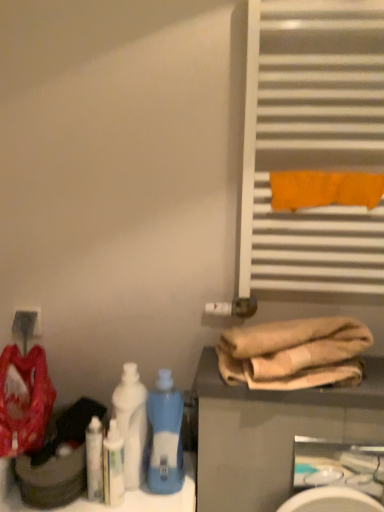
The image size is (384, 512). What do you see at coordinates (24, 400) in the screenshot? I see `matte red fabric at left` at bounding box center [24, 400].

Where is `white metallic radiator at upper right`? This screenshot has width=384, height=512. white metallic radiator at upper right is located at coordinates (312, 143).

What do you see at coordinates (292, 353) in the screenshot?
I see `beige cotton towels at lower right` at bounding box center [292, 353].

Locate an element on the screen. The height and width of the screenshot is (512, 384). matte white electric outlet at lower left is located at coordinates (27, 323).

Does white glossy bottle at lower left, marked as the 2th cleaning product in a left-to-right arrangement, have a smaller size compared to white glossy sink at lower right?

Correct, white glossy bottle at lower left, marked as the 2th cleaning product in a left-to-right arrangement, occupies less space than white glossy sink at lower right.

Looking at this image, how much distance is there between white glossy bottle at lower left, which is the 1th cleaning product in right-to-left order, and white glossy sink at lower right?

The distance of white glossy bottle at lower left, which is the 1th cleaning product in right-to-left order, from white glossy sink at lower right is 5.19 feet.

Is white glossy bottle at lower left, which is the 1th cleaning product in right-to-left order, at the right side of white glossy sink at lower right?

In fact, white glossy bottle at lower left, which is the 1th cleaning product in right-to-left order, is to the left of white glossy sink at lower right.

In terms of width, does white glossy bottle at lower left, which is the 1th cleaning product in right-to-left order, look wider or thinner when compared to white glossy sink at lower right?

In the image, white glossy bottle at lower left, which is the 1th cleaning product in right-to-left order, appears to be wider than white glossy sink at lower right.

Is white metallic radiator at upper right not close to beige cotton towels at lower right?

Actually, white metallic radiator at upper right and beige cotton towels at lower right are a little close together.

Which is more to the left, white metallic radiator at upper right or beige cotton towels at lower right?

From the viewer's perspective, beige cotton towels at lower right appears more on the left side.

Is white metallic radiator at upper right situated inside beige cotton towels at lower right or outside?

white metallic radiator at upper right lies outside beige cotton towels at lower right.

Is point (312, 112) more distant than point (245, 349)?

That is True.

From a real-world perspective, between matte red fabric at left and white plastic bottle at center, the 2th bottle positioned from the right, who is vertically lower?

In real-world perspective, white plastic bottle at center, the 2th bottle positioned from the right, is lower.

From the image's perspective, would you say matte red fabric at left is positioned over white plastic bottle at center, the first bottle positioned from the left?

Yes.

Where is `material that appears in front of the white plastic bottle at center, the first bottle positioned from the left`? material that appears in front of the white plastic bottle at center, the first bottle positioned from the left is located at coordinates (24, 400).

Does matte red fabric at left contain white plastic bottle at center, the 2th bottle positioned from the right?

No, white plastic bottle at center, the 2th bottle positioned from the right, is located outside of matte red fabric at left.

Between white glossy bottle at lower left, marked as the 2th cleaning product in a left-to-right arrangement, and white plastic bottle at center, the first bottle positioned from the left, which one has less height?

With less height is white glossy bottle at lower left, marked as the 2th cleaning product in a left-to-right arrangement.

Does point (120, 443) appear closer or farther from the camera than point (143, 435)?

Point (120, 443) is closer to the camera than point (143, 435).

Would you consider white glossy bottle at lower left, marked as the 2th cleaning product in a left-to-right arrangement, to be distant from white plastic bottle at center, the first bottle positioned from the left?

No, white glossy bottle at lower left, marked as the 2th cleaning product in a left-to-right arrangement, is not far from white plastic bottle at center, the first bottle positioned from the left.

Measure the distance from white glossy bottle at lower left, marked as the 2th cleaning product in a left-to-right arrangement, to white plastic bottle at center, the first bottle positioned from the left.

The distance of white glossy bottle at lower left, marked as the 2th cleaning product in a left-to-right arrangement, from white plastic bottle at center, the first bottle positioned from the left, is 2.30 inches.

From a real-world perspective, which is physically above, matte red fabric at left or white metallic radiator at upper right?

In real-world perspective, white metallic radiator at upper right is above.

Can you confirm if matte red fabric at left is shorter than white metallic radiator at upper right?

Correct, matte red fabric at left is not as tall as white metallic radiator at upper right.

Considering the positions of points (29, 402) and (254, 261), is point (29, 402) farther from camera compared to point (254, 261)?

No.

Does matte red fabric at left have a lesser width compared to white metallic radiator at upper right?

No, matte red fabric at left is not thinner than white metallic radiator at upper right.

In the scene shown: From the image's perspective, which one is positioned lower, white glossy sink at lower right or matte white electric outlet at lower left?

white glossy sink at lower right is shown below in the image.

Find the location of a particular element. This screenshot has width=384, height=512. electric outlet behind the white glossy sink at lower right is located at coordinates (27, 323).

From a real-world perspective, between white glossy sink at lower right and matte white electric outlet at lower left, who is vertically higher?

matte white electric outlet at lower left is physically above.

Would you say white glossy sink at lower right is outside matte white electric outlet at lower left?

Yes, white glossy sink at lower right is outside of matte white electric outlet at lower left.

Considering the relative sizes of matte white electric outlet at lower left and white glossy bottle at lower left, marked as the 2th cleaning product in a left-to-right arrangement, in the image provided, is matte white electric outlet at lower left shorter than white glossy bottle at lower left, marked as the 2th cleaning product in a left-to-right arrangement,?

Yes, matte white electric outlet at lower left is shorter than white glossy bottle at lower left, marked as the 2th cleaning product in a left-to-right arrangement.

Is matte white electric outlet at lower left situated inside white glossy bottle at lower left, which is the 1th cleaning product in right-to-left order, or outside?

matte white electric outlet at lower left exists outside the volume of white glossy bottle at lower left, which is the 1th cleaning product in right-to-left order.

Which object is positioned more to the right, matte white electric outlet at lower left or white glossy bottle at lower left, which is the 1th cleaning product in right-to-left order?

From the viewer's perspective, white glossy bottle at lower left, which is the 1th cleaning product in right-to-left order, appears more on the right side.

In order to click on electric outlet that appears above the white glossy bottle at lower left, which is the 1th cleaning product in right-to-left order (from the image's perspective) in this screenshot , I will do `click(27, 323)`.

This screenshot has width=384, height=512. In order to click on sink located below the white glossy bottle at lower left, marked as the 2th cleaning product in a left-to-right arrangement (from the image's perspective) in this screenshot , I will do `click(338, 465)`.

Locate an element on the screen. This screenshot has width=384, height=512. shutter located above the beige cotton towels at lower right (from the image's perspective) is located at coordinates (312, 143).

When comparing their distances from white metallic radiator at upper right, does matte red fabric at left or white plastic bottle at center, the 2th bottle positioned from the right, seem further?

Among the two, matte red fabric at left is located further to white metallic radiator at upper right.

Based on their spatial positions, is white glossy bottle at lower left, which is the first cleaning product from left to right, or white glossy bottle at lower left, which is the 1th cleaning product in right-to-left order, closer to matte white electric outlet at lower left?

Based on the image, white glossy bottle at lower left, which is the first cleaning product from left to right, appears to be nearer to matte white electric outlet at lower left.

Which object lies further to the anchor point blue plastic bottle at center, which is counted as the first bottle, starting from the right, matte red fabric at left or white glossy bottle at lower left, the 2th cleaning product when ordered from right to left?

Among the two, matte red fabric at left is located further to blue plastic bottle at center, which is counted as the first bottle, starting from the right.

Which object lies nearer to the anchor point white glossy bottle at lower left, which is the 1th cleaning product in right-to-left order, matte white electric outlet at lower left or white plastic bottle at center, the 2th bottle positioned from the right?

white plastic bottle at center, the 2th bottle positioned from the right, lies closer to white glossy bottle at lower left, which is the 1th cleaning product in right-to-left order, than the other object.

Looking at the image, which one is located further to white plastic bottle at center, the 2th bottle positioned from the right, white glossy bottle at lower left, which is the 1th cleaning product in right-to-left order, or white metallic radiator at upper right?

white metallic radiator at upper right lies further to white plastic bottle at center, the 2th bottle positioned from the right, than the other object.

From the picture: Based on their spatial positions, is white glossy bottle at lower left, which is the first cleaning product from left to right, or matte red fabric at left closer to white glossy sink at lower right?

The object closer to white glossy sink at lower right is matte red fabric at left.

Estimate the real-world distances between objects in this image. Which object is closer to white glossy bottle at lower left, which is the 1th cleaning product in right-to-left order, white plastic bottle at center, the 2th bottle positioned from the right, or matte red fabric at left?

white plastic bottle at center, the 2th bottle positioned from the right, is closer to white glossy bottle at lower left, which is the 1th cleaning product in right-to-left order.

From the image, which object appears to be farther from matte white electric outlet at lower left, beige cotton towels at lower right or white plastic bottle at center, the 2th bottle positioned from the right?

The object further to matte white electric outlet at lower left is beige cotton towels at lower right.

In order to click on bottle between white glossy bottle at lower left, which is the 1th cleaning product in right-to-left order, and blue plastic bottle at center, which is counted as the first bottle, starting from the right in this screenshot , I will do `click(132, 424)`.

Find the location of a particular element. material between matte white electric outlet at lower left and blue plastic bottle at center, which is counted as the first bottle, starting from the right, from left to right is located at coordinates (24, 400).

Where is `towel located between blue plastic bottle at center, the second bottle when ordered from left to right, and white glossy sink at lower right in the left-right direction`? towel located between blue plastic bottle at center, the second bottle when ordered from left to right, and white glossy sink at lower right in the left-right direction is located at coordinates (292, 353).

This screenshot has width=384, height=512. In order to click on shutter between matte white electric outlet at lower left and white glossy sink at lower right in this screenshot , I will do `click(312, 143)`.